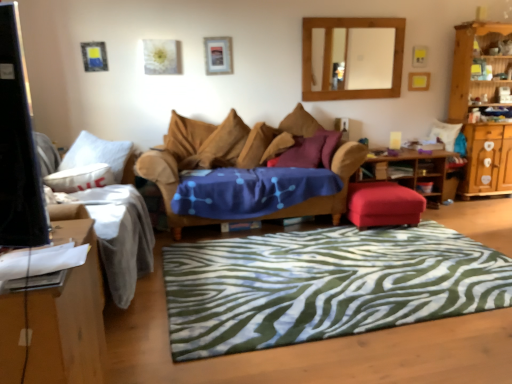
Question: Considering the relative sizes of brown fabric pillow at center, the 2th pillow from the left, and metallic silver picture frame at upper center in the image provided, is brown fabric pillow at center, the 2th pillow from the left, wider than metallic silver picture frame at upper center?

Choices:
 (A) no
 (B) yes

Answer: (B)

Question: Is brown fabric pillow at center, the 2th pillow from the left, not near metallic silver picture frame at upper center?

Choices:
 (A) no
 (B) yes

Answer: (A)

Question: Can you confirm if brown fabric pillow at center, the 2th pillow from the left, is taller than metallic silver picture frame at upper center?

Choices:
 (A) yes
 (B) no

Answer: (A)

Question: Can you confirm if brown fabric pillow at center, arranged as the third pillow when viewed from the right, is thinner than metallic silver picture frame at upper center?

Choices:
 (A) no
 (B) yes

Answer: (A)

Question: From the image's perspective, does brown fabric pillow at center, arranged as the third pillow when viewed from the right, appear higher than metallic silver picture frame at upper center?

Choices:
 (A) no
 (B) yes

Answer: (A)

Question: From a real-world perspective, is brown fabric pillow at center, arranged as the third pillow when viewed from the right, above or below metallic silver picture frame at upper center?

Choices:
 (A) below
 (B) above

Answer: (A)

Question: Considering the relative positions of brown fabric pillow at center, arranged as the third pillow when viewed from the right, and metallic silver picture frame at upper center in the image provided, is brown fabric pillow at center, arranged as the third pillow when viewed from the right, to the left or to the right of metallic silver picture frame at upper center?

Choices:
 (A) right
 (B) left

Answer: (A)

Question: From their relative heights in the image, would you say brown fabric pillow at center, the 2th pillow from the left, is taller or shorter than metallic silver picture frame at upper center?

Choices:
 (A) short
 (B) tall

Answer: (B)

Question: Considering their positions, is brown fabric pillow at center, the 2th pillow from the left, located in front of or behind metallic silver picture frame at upper center?

Choices:
 (A) front
 (B) behind

Answer: (A)

Question: In terms of size, does velvet brown couch at center, placed as the 1th studio couch when sorted from right to left, appear bigger or smaller than green zebra-patterned rug at center?

Choices:
 (A) small
 (B) big

Answer: (B)

Question: Looking at their shapes, would you say velvet brown couch at center, placed as the 1th studio couch when sorted from right to left, is wider or thinner than green zebra-patterned rug at center?

Choices:
 (A) wide
 (B) thin

Answer: (B)

Question: Is velvet brown couch at center, placed as the 1th studio couch when sorted from right to left, inside the boundaries of green zebra-patterned rug at center, or outside?

Choices:
 (A) outside
 (B) inside

Answer: (A)

Question: From a real-world perspective, is velvet brown couch at center, which is counted as the 2th studio couch, starting from the left, physically located above or below green zebra-patterned rug at center?

Choices:
 (A) below
 (B) above

Answer: (B)

Question: From the image's perspective, is metallic silver picture frame at upper center above or below wooden framed mirror at upper center?

Choices:
 (A) above
 (B) below

Answer: (B)

Question: Is point (207, 52) positioned closer to the camera than point (359, 56)?

Choices:
 (A) closer
 (B) farther

Answer: (A)